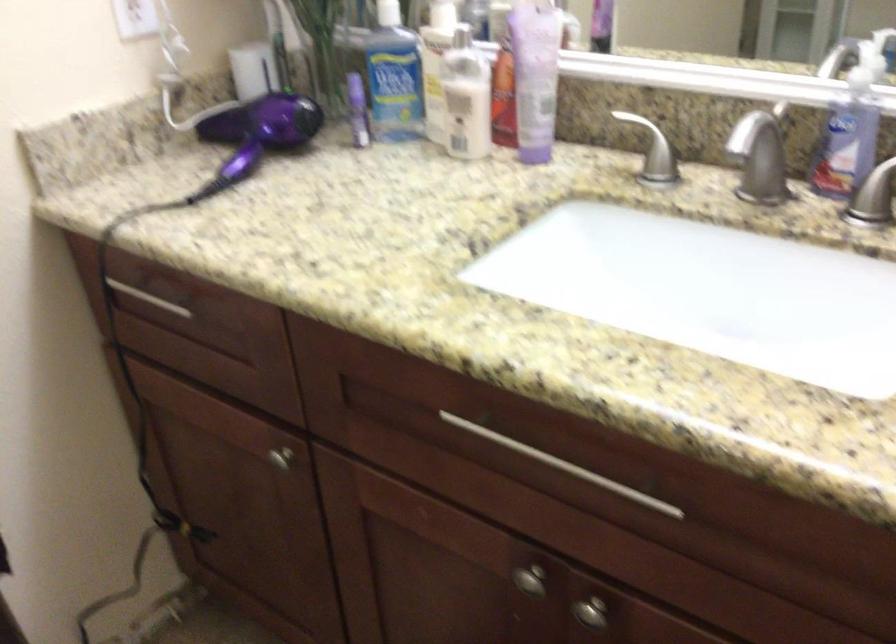
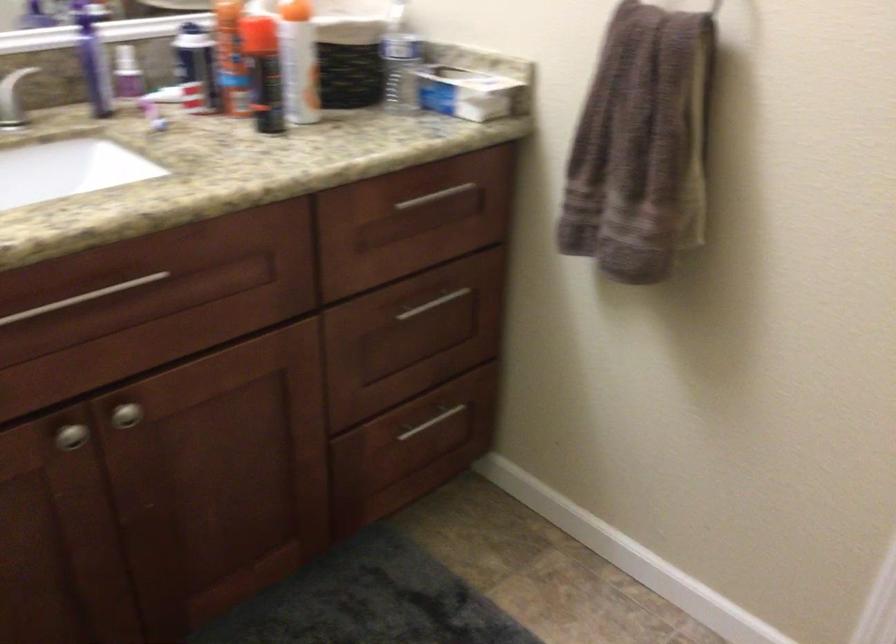
Find the pixel in the second image that matches [567,458] in the first image.

(82, 298)